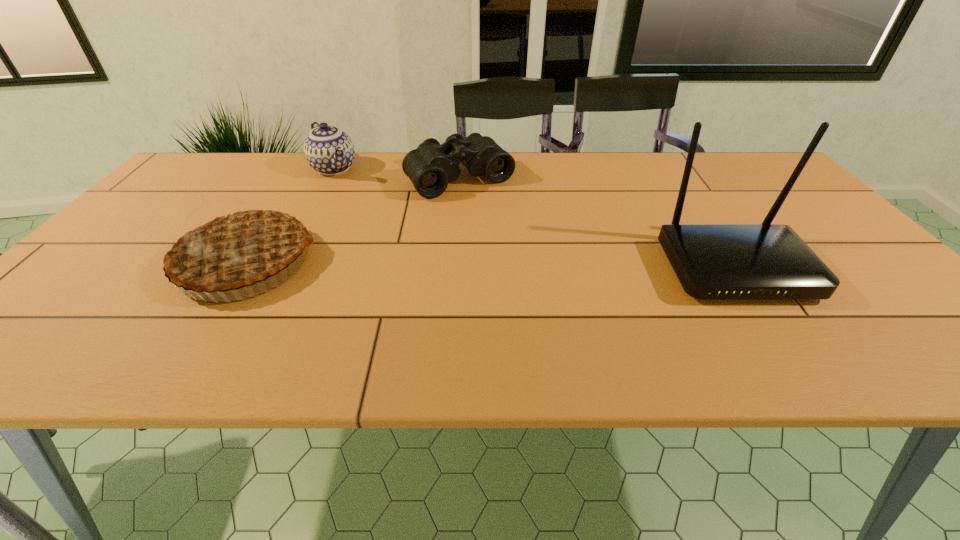
Identify which object is the second nearest to the second tallest object. Please provide its 2D coordinates. Your answer should be formatted as a tuple, i.e. [(x, y)], where the tuple contains the x and y coordinates of a point satisfying the conditions above.

[(328, 150)]

Locate an element on the screen. vacant space that satisfies the following two spatial constraints: 1. on the back side of the second tallest object; 2. on the left side of the chinaware is located at coordinates pyautogui.click(x=306, y=168).